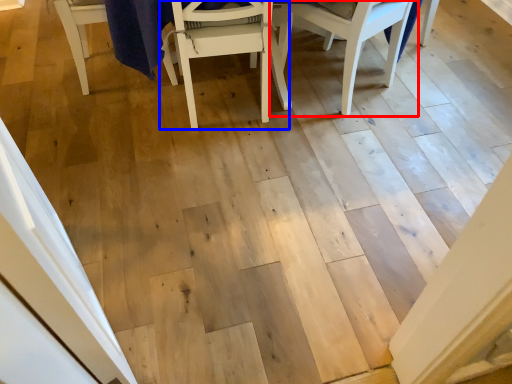
Question: Which of the following is the farthest to the observer, chair (highlighted by a red box) or chair (highlighted by a blue box)?

Choices:
 (A) chair
 (B) chair

Answer: (A)